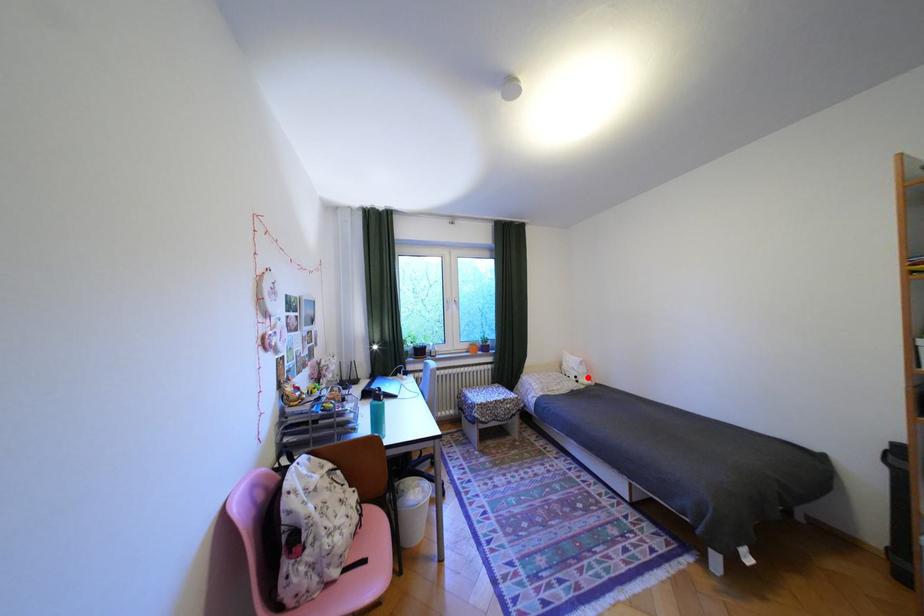
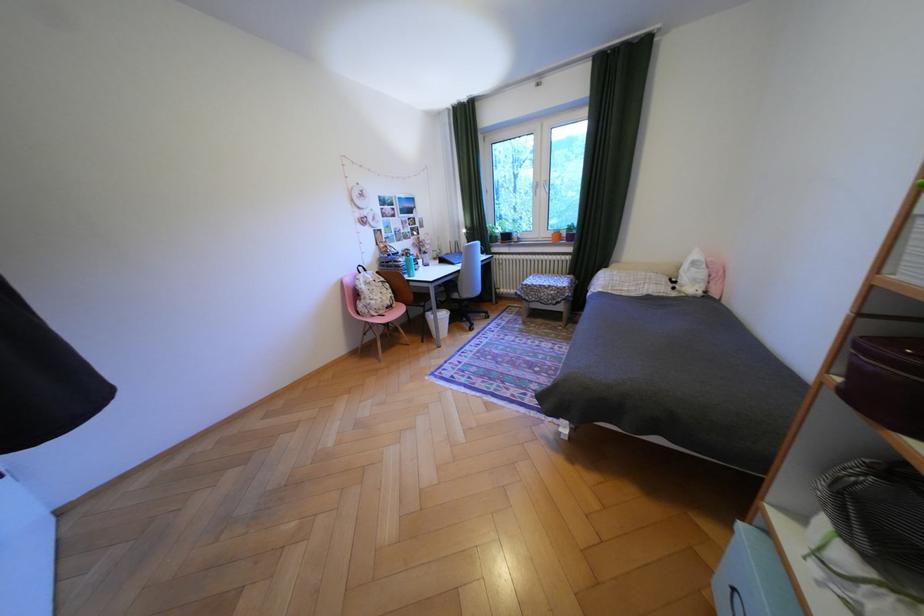
Question: I am providing you with two images of the same scene from different viewpoints. Given a red point in image1, look at the same physical point in image2. Is it:

Choices:
 (A) Closer to the viewpoint
 (B) Farther from the viewpoint

Answer: (A)